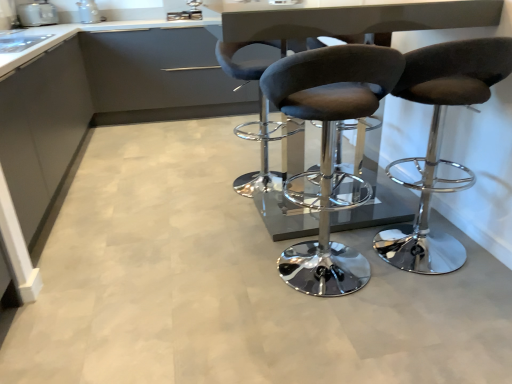
Question: Is velvet-like dark gray stool at center, the 2th chair positioned from the right, oriented towards metallic gray table at center?

Choices:
 (A) no
 (B) yes

Answer: (B)

Question: Does velvet-like dark gray stool at center, the second chair when ordered from left to right, appear on the left side of metallic gray table at center?

Choices:
 (A) yes
 (B) no

Answer: (A)

Question: From a real-world perspective, is velvet-like dark gray stool at center, the second chair when ordered from left to right, beneath metallic gray table at center?

Choices:
 (A) yes
 (B) no

Answer: (A)

Question: Is velvet-like dark gray stool at center, the second chair when ordered from left to right, further to camera compared to metallic gray table at center?

Choices:
 (A) no
 (B) yes

Answer: (A)

Question: Is velvet-like dark gray stool at center, the 2th chair positioned from the right, smaller than metallic gray table at center?

Choices:
 (A) no
 (B) yes

Answer: (B)

Question: Would you say velvet-like dark gray stool at center, the 2th chair positioned from the right, is outside metallic gray table at center?

Choices:
 (A) yes
 (B) no

Answer: (A)

Question: From a real-world perspective, is dark gray fabric stool at center, the first chair in the left-to-right sequence, under white glossy toaster at upper left, which is the first appliance from right to left?

Choices:
 (A) yes
 (B) no

Answer: (A)

Question: Is dark gray fabric stool at center, which is the 3th chair from right to left, to the left of white glossy toaster at upper left, which is the first appliance from right to left, from the viewer's perspective?

Choices:
 (A) yes
 (B) no

Answer: (B)

Question: Is dark gray fabric stool at center, which is the 3th chair from right to left, further to the viewer compared to white glossy toaster at upper left, the second appliance in the left-to-right sequence?

Choices:
 (A) no
 (B) yes

Answer: (A)

Question: Is dark gray fabric stool at center, the first chair in the left-to-right sequence, in contact with white glossy toaster at upper left, the second appliance in the left-to-right sequence?

Choices:
 (A) no
 (B) yes

Answer: (A)

Question: Would you say dark gray fabric stool at center, the first chair in the left-to-right sequence, is a long distance from white glossy toaster at upper left, which is the first appliance from right to left?

Choices:
 (A) no
 (B) yes

Answer: (B)

Question: Is white glossy toaster at upper left, which is the first appliance from right to left, surrounded by dark gray fabric stool at center, the first chair in the left-to-right sequence?

Choices:
 (A) yes
 (B) no

Answer: (B)

Question: Is suede-like brown stool at center, arranged as the first chair when viewed from the right, shorter than dark gray fabric stool at center, the first chair in the left-to-right sequence?

Choices:
 (A) yes
 (B) no

Answer: (B)